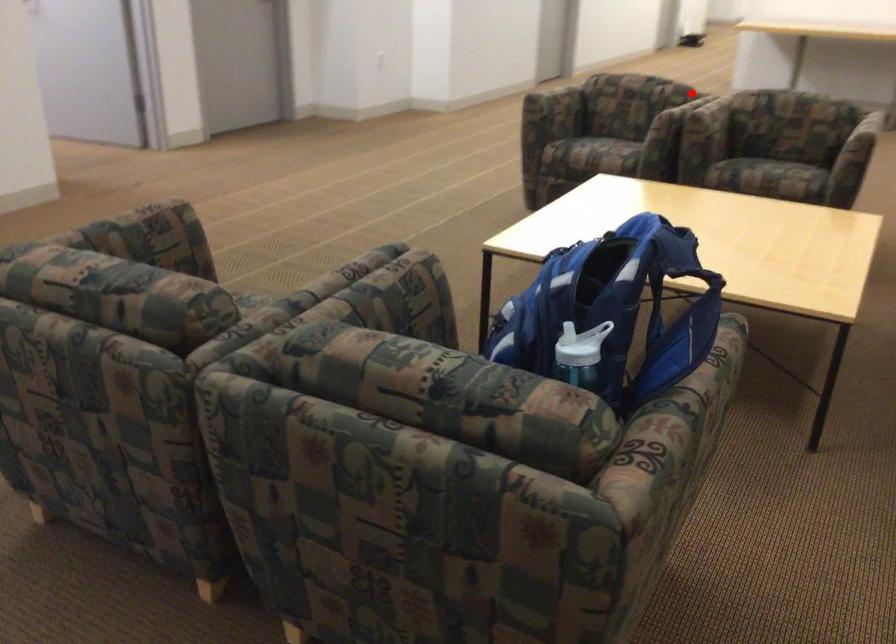
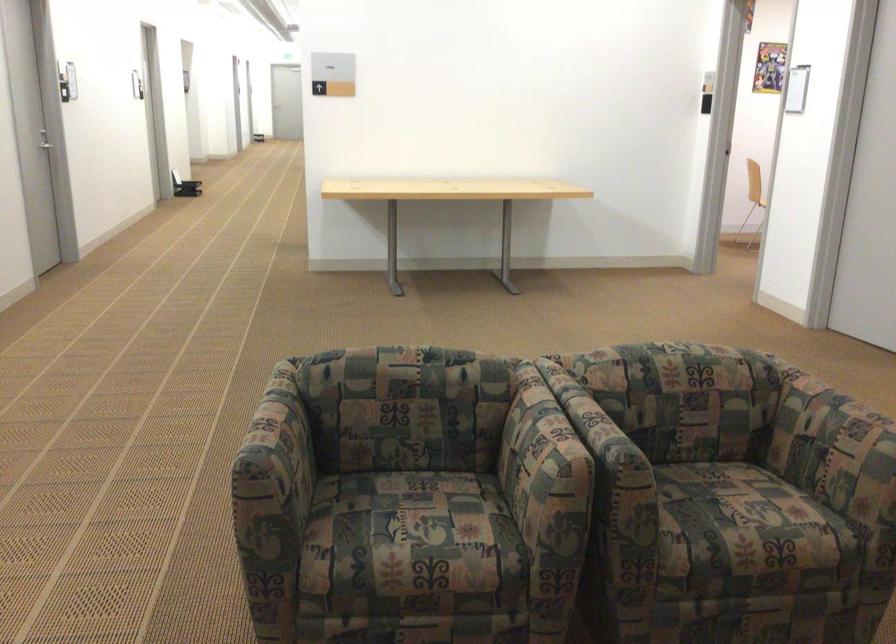
Where in the second image is the point corresponding to the highlighted location from the first image?

(595, 427)